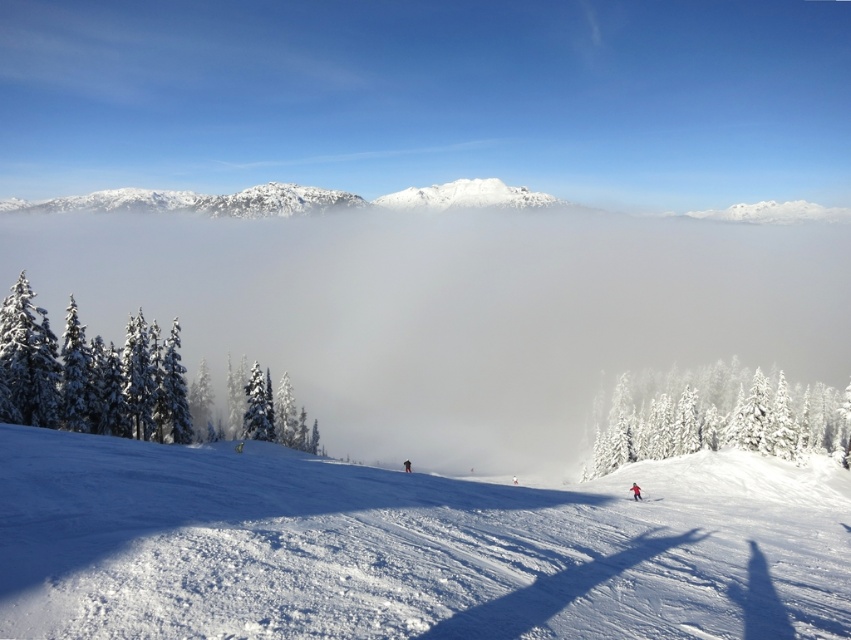
Question: Which point is closer to the camera taking this photo?

Choices:
 (A) click(55, 368)
 (B) click(631, 486)

Answer: (A)

Question: Among these points, which one is farthest from the camera?

Choices:
 (A) (295, 442)
 (B) (729, 372)
 (C) (652, 499)

Answer: (B)

Question: Does white fluffy fog at center have a larger size compared to white frosty trees at center?

Choices:
 (A) no
 (B) yes

Answer: (B)

Question: Which of the following is the closest to the observer?

Choices:
 (A) [153, 342]
 (B) [647, 499]

Answer: (B)

Question: Where is white frosty trees at center located in relation to red matte ski at lower right in the image?

Choices:
 (A) left
 (B) right

Answer: (B)

Question: Considering the relative positions of red matte ski at lower right and red fabric snowboarder at lower right in the image provided, where is red matte ski at lower right located with respect to red fabric snowboarder at lower right?

Choices:
 (A) above
 (B) below

Answer: (A)